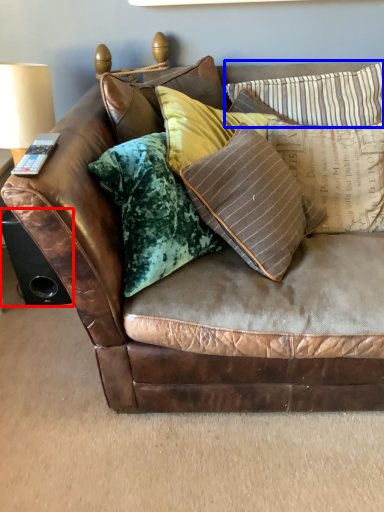
Question: Which object appears farthest to the camera in this image, speaker (highlighted by a red box) or pillow (highlighted by a blue box)?

Choices:
 (A) speaker
 (B) pillow

Answer: (A)